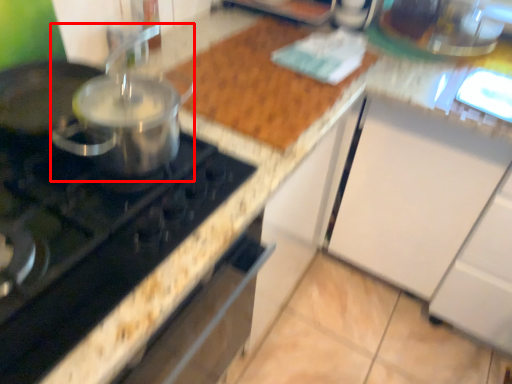
Question: In this image, where is kitchen appliance (annotated by the red box) located relative to gas stove?

Choices:
 (A) right
 (B) left

Answer: (B)